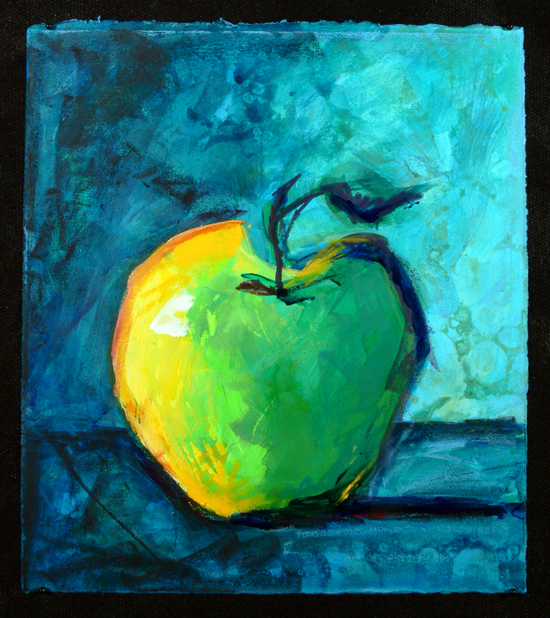
Where is `paitning`? The height and width of the screenshot is (618, 550). paitning is located at coordinates (232, 400).